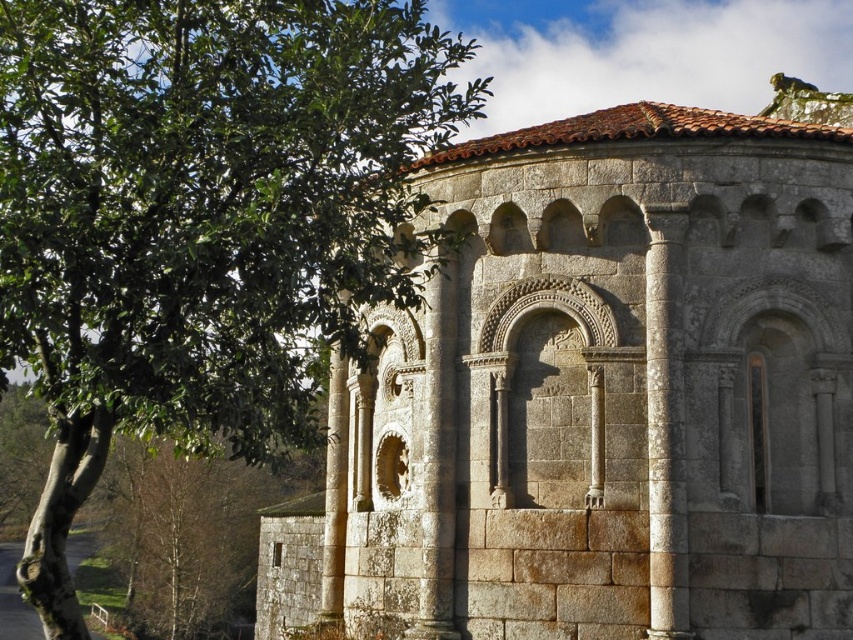
Is gray stone building at center below gray stone column at right?

Indeed, gray stone building at center is positioned under gray stone column at right.

What do you see at coordinates (601, 396) in the screenshot?
I see `gray stone building at center` at bounding box center [601, 396].

Locate an element on the screen. This screenshot has width=853, height=640. gray stone building at center is located at coordinates (601, 396).

Find the location of a particular element. The height and width of the screenshot is (640, 853). gray stone building at center is located at coordinates (601, 396).

Between green leafy tree at upper left and gray stone column at right, which one is positioned higher?

green leafy tree at upper left

Between green leafy tree at upper left and gray stone column at right, which one appears on the left side from the viewer's perspective?

Positioned to the left is green leafy tree at upper left.

You are a GUI agent. You are given a task and a screenshot of the screen. Output one action in this format:
    pyautogui.click(x=<x>, y=<y>)
    Task: Click on the green leafy tree at upper left
    This screenshot has width=853, height=640.
    Given the screenshot: What is the action you would take?
    pyautogui.click(x=202, y=220)

Find the location of `green leafy tree at upper left`. green leafy tree at upper left is located at coordinates (202, 220).

Which of these two, gray stone building at center or green leafy tree at upper left, stands taller?

With more height is green leafy tree at upper left.

Is point (543, 525) positioned behind point (94, 321)?

Yes, it is behind point (94, 321).

Who is more forward, (608, 307) or (42, 186)?

Point (42, 186) is more forward.

The height and width of the screenshot is (640, 853). What are the coordinates of `gray stone building at center` in the screenshot? It's located at (601, 396).